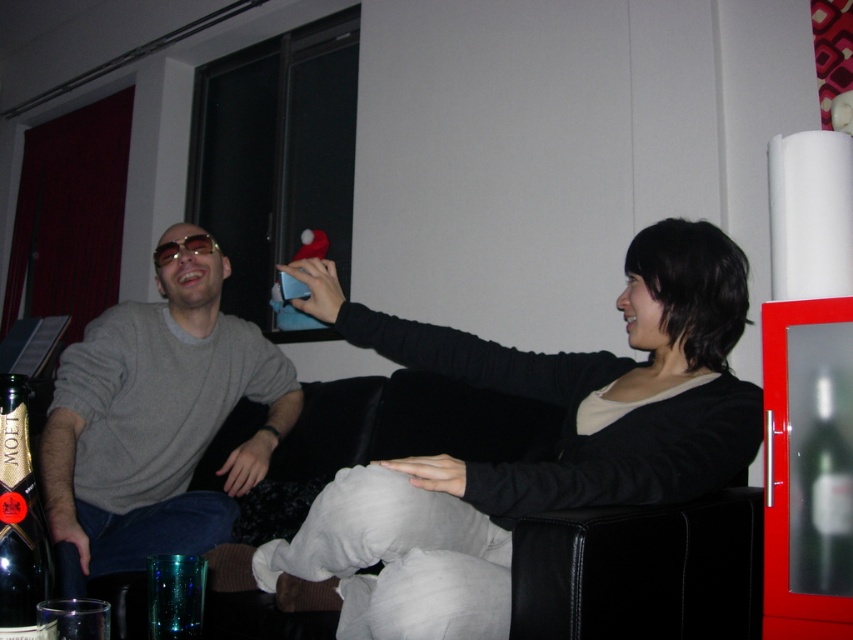
Can you confirm if dark glass bottle at lower left is shorter than translucent glass bottle at right?

Correct, dark glass bottle at lower left is not as tall as translucent glass bottle at right.

Measure the distance between dark glass bottle at lower left and camera.

dark glass bottle at lower left is 24.34 inches from camera.

You are a GUI agent. You are given a task and a screenshot of the screen. Output one action in this format:
    pyautogui.click(x=<x>, y=<y>)
    Task: Click on the dark glass bottle at lower left
    This screenshot has height=640, width=853.
    Given the screenshot: What is the action you would take?
    pyautogui.click(x=19, y=515)

Locate an element on the screen. The height and width of the screenshot is (640, 853). translucent glass bottle at right is located at coordinates (824, 500).

In the scene shown: Measure the distance between translucent glass bottle at right and camera.

A distance of 4.03 feet exists between translucent glass bottle at right and camera.

Measure the distance between translucent glass bottle at right and camera.

translucent glass bottle at right is 1.23 meters from camera.

Image resolution: width=853 pixels, height=640 pixels. Find the location of `translucent glass bottle at right`. translucent glass bottle at right is located at coordinates (824, 500).

Who is taller, matte black sweater at center or dark glass bottle at lower left?

With more height is matte black sweater at center.

The image size is (853, 640). What are the coordinates of `matte black sweater at center` in the screenshot? It's located at (520, 461).